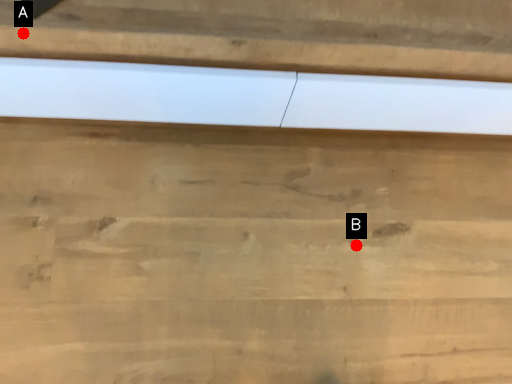
Question: Two points are circled on the image, labeled by A and B beside each circle. Which point is closer to the camera taking this photo?

Choices:
 (A) A is closer
 (B) B is closer

Answer: (A)